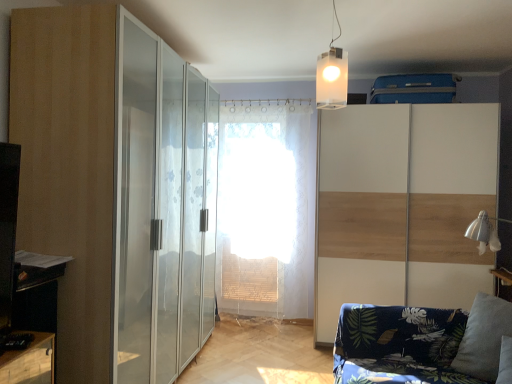
Where is `vacant space underneath white sheer curtain at center (from a real-world perspective)`? The image size is (512, 384). vacant space underneath white sheer curtain at center (from a real-world perspective) is located at coordinates (258, 322).